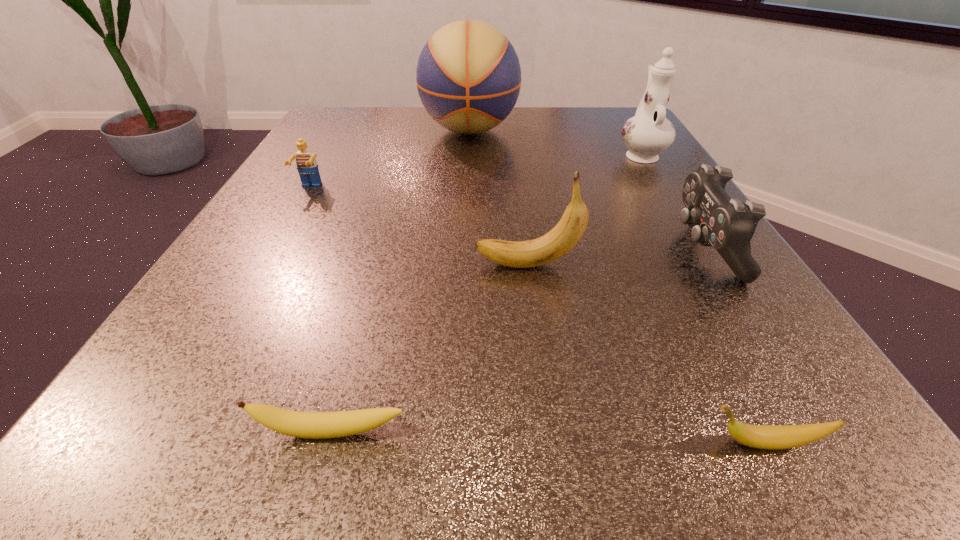
Find the location of `banana that can be found as the third closest to the fourth tallest object`. banana that can be found as the third closest to the fourth tallest object is located at coordinates (314, 425).

What are the coordinates of `free space that satisfies the following two spatial constraints: 1. at the start of the peel on the third tallest object; 2. on the upward curve of the leftmost banana` in the screenshot? It's located at (549, 433).